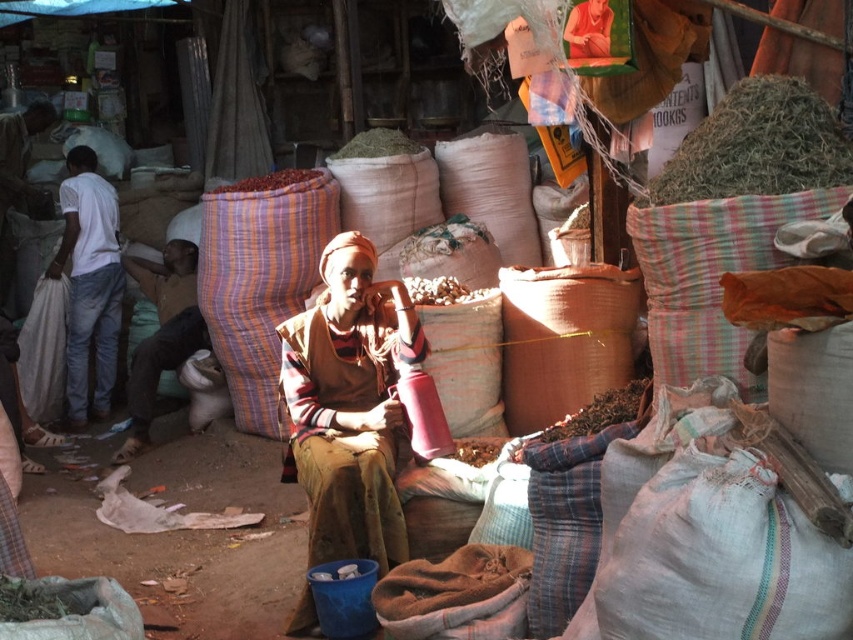
You are a customer looking to buy both the brown woven grain at center and the smooth red beans at center. Which item is located to the right of the other?

The brown woven grain at center is positioned on the right side of smooth red beans at center.

You are a delivery person who needs to place a package between the brown woven cloth at center and the smooth red beans at center. Can you fit the package if it requires 7 feet of space?

The distance between the brown woven cloth at center and the smooth red beans at center is 6.99 feet, so the package requiring 7 feet of space cannot fit between them.

You are a delivery person who needs to place a package between the brown woven cloth at center and the brown woven grain at center. The package requires a space of 8 feet. Is there enough space between them?

The brown woven cloth at center is 8.29 feet from brown woven grain at center, so yes, the package can be placed between them as the distance is sufficient.